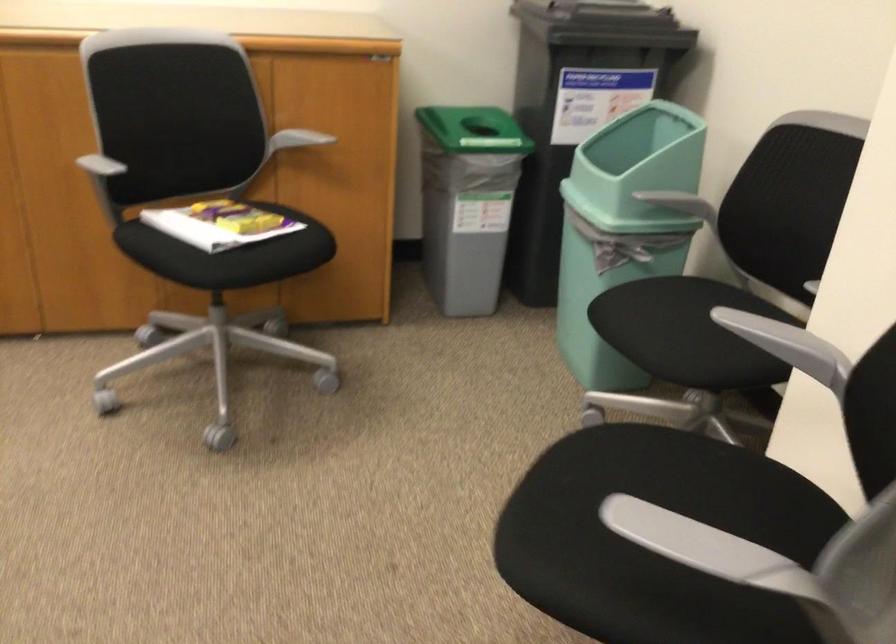
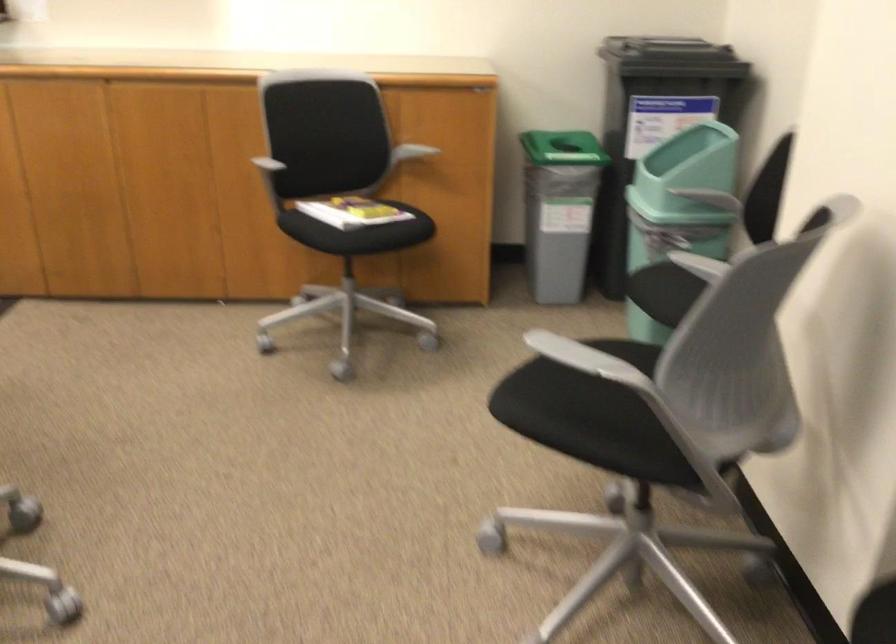
The point at (296,142) is marked in the first image. Where is the corresponding point in the second image?

(409, 152)